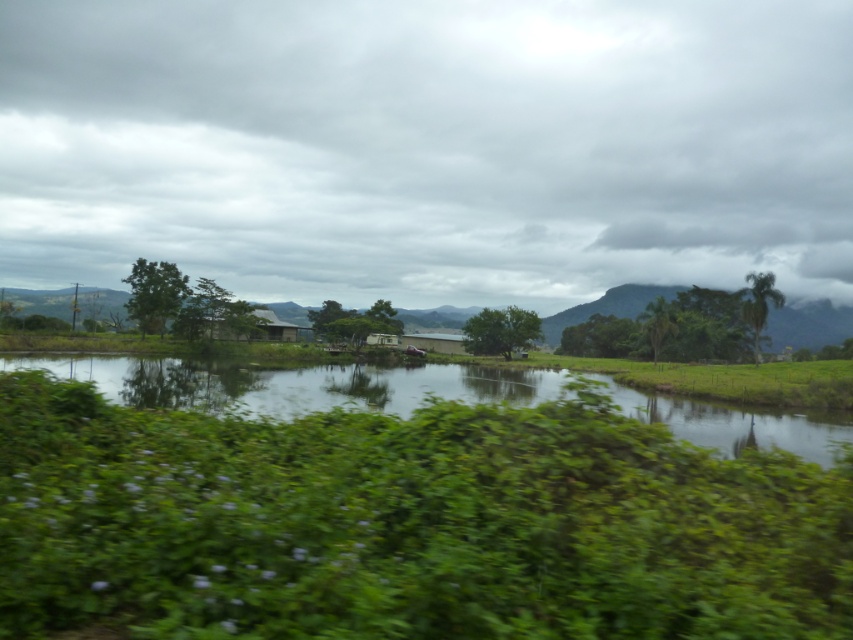
This screenshot has width=853, height=640. Identify the location of green leafy bush at center. (405, 524).

Does green leafy bush at center appear over green reflective water at center?

Correct, green leafy bush at center is located above green reflective water at center.

Is point (518, 580) farther from camera compared to point (556, 394)?

No, (518, 580) is in front of (556, 394).

Find the location of `green leafy bush at center`. green leafy bush at center is located at coordinates (405, 524).

Between green leafy bush at center and green leafy tree at center, which one appears on the right side from the viewer's perspective?

green leafy tree at center

Is point (374, 589) behind point (534, 330)?

No, (374, 589) is in front of (534, 330).

Is point (39, 477) in front of point (526, 337)?

That is True.

Image resolution: width=853 pixels, height=640 pixels. Find the location of `green leafy bush at center`. green leafy bush at center is located at coordinates (405, 524).

Who is positioned more to the right, green reflective water at center or green leafy tree at center?

Positioned to the right is green leafy tree at center.

Is point (294, 388) positioned after point (514, 340)?

No, (294, 388) is closer to viewer.

You are a GUI agent. You are given a task and a screenshot of the screen. Output one action in this format:
    pyautogui.click(x=<x>, y=<y>)
    Task: Click on the green reflective water at center
    This screenshot has width=853, height=640.
    Given the screenshot: What is the action you would take?
    pyautogui.click(x=293, y=385)